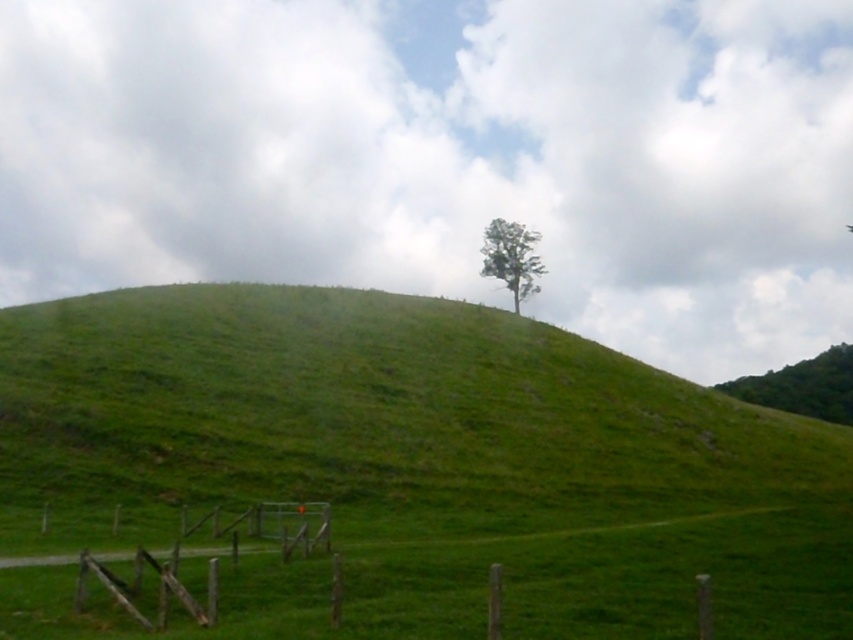
You are a hiker who wants to reach the green leafy tree at upper right from the green grassy hillside at center. Based on the distance provided, can you estimate how long it would take you to walk there at a normal pace?

The distance between the green grassy hillside at center and the green leafy tree at upper right is 75.87 meters. At a normal walking pace of approximately 1.4 meters per second, it would take roughly 54 seconds to reach the tree.

You are a hiker standing at the base of the hill and looking up. You see the green leafy tree at upper right and the green leafy tree at center. Which tree is closer to you?

The green leafy tree at upper right is positioned under the green leafy tree at center, meaning it is closer to you.